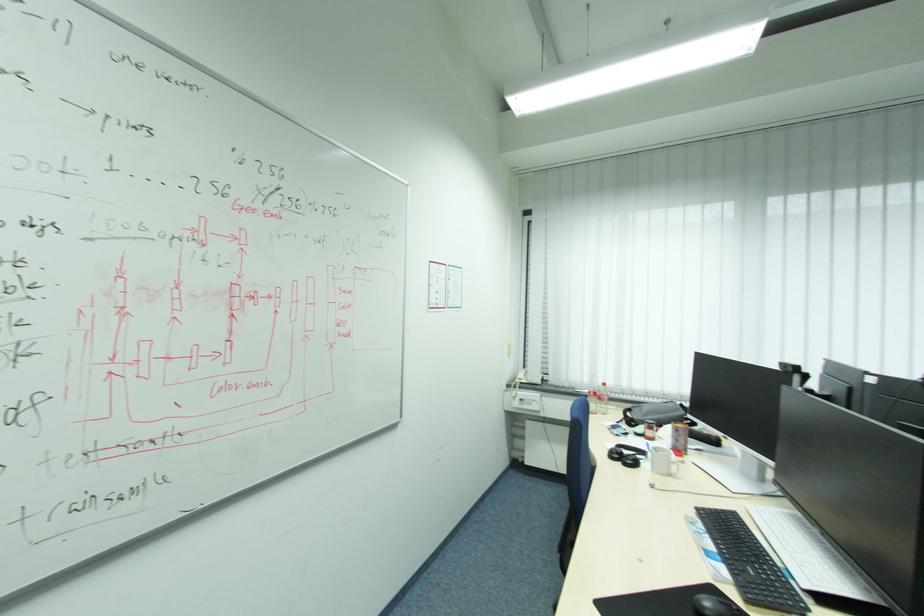
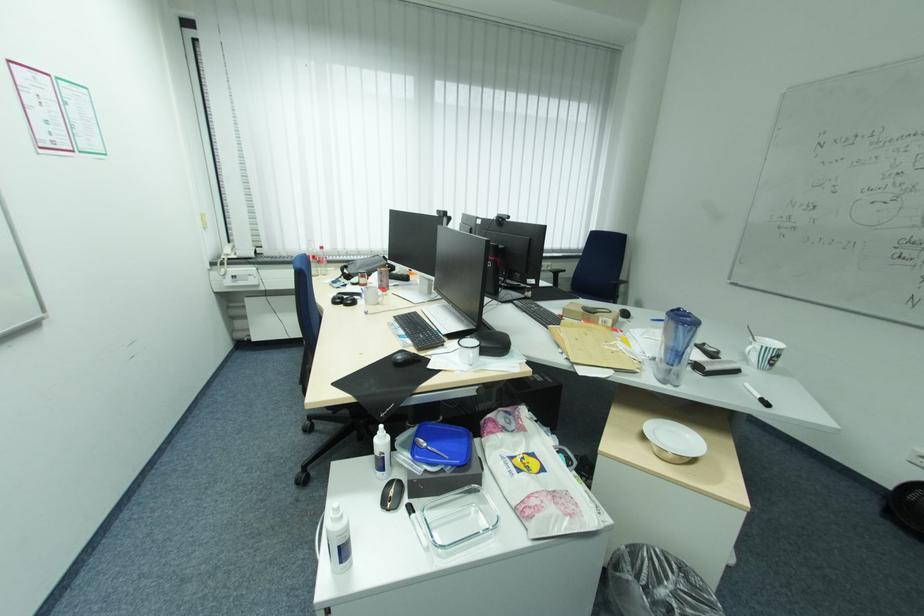
How did the camera likely rotate?

The camera rotated toward right-down.